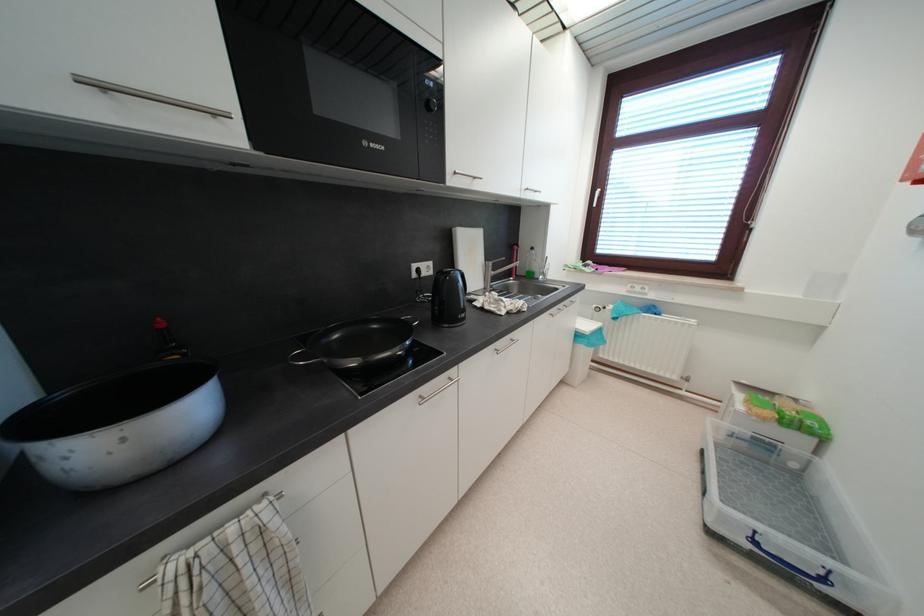
Find where to turn the sink faucet handle. Please return your answer as a coordinate pair (x, y).

(493, 272)